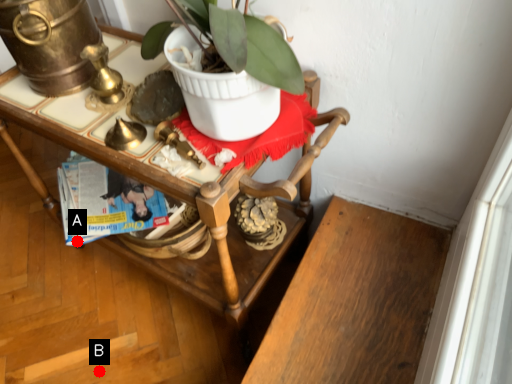
Question: Two points are circled on the image, labeled by A and B beside each circle. Which point is farther from the camera taking this photo?

Choices:
 (A) A is further
 (B) B is further

Answer: (B)